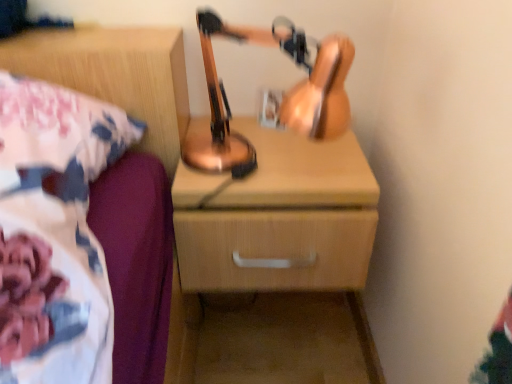
Question: Should I look upward or downward to see copper metallic table lamp at center?

Choices:
 (A) down
 (B) up

Answer: (B)

Question: Can you confirm if wooden chest of drawers at center is taller than copper metallic table lamp at center?

Choices:
 (A) yes
 (B) no

Answer: (B)

Question: From a real-world perspective, is wooden chest of drawers at center physically above copper metallic table lamp at center?

Choices:
 (A) no
 (B) yes

Answer: (A)

Question: Is the position of wooden chest of drawers at center more distant than that of copper metallic table lamp at center?

Choices:
 (A) no
 (B) yes

Answer: (B)

Question: Is wooden chest of drawers at center smaller than copper metallic table lamp at center?

Choices:
 (A) no
 (B) yes

Answer: (A)

Question: From a real-world perspective, is wooden chest of drawers at center beneath copper metallic table lamp at center?

Choices:
 (A) no
 (B) yes

Answer: (B)

Question: Does wooden chest of drawers at center have a lesser height compared to copper metallic table lamp at center?

Choices:
 (A) yes
 (B) no

Answer: (A)

Question: Is wooden nightstand at upper right at the left side of wooden chest of drawers at center?

Choices:
 (A) yes
 (B) no

Answer: (A)

Question: Does wooden nightstand at upper right lie in front of wooden chest of drawers at center?

Choices:
 (A) no
 (B) yes

Answer: (B)

Question: Is wooden nightstand at upper right far from wooden chest of drawers at center?

Choices:
 (A) yes
 (B) no

Answer: (B)

Question: Is wooden nightstand at upper right turned away from wooden chest of drawers at center?

Choices:
 (A) yes
 (B) no

Answer: (B)

Question: Is wooden nightstand at upper right at the right side of wooden chest of drawers at center?

Choices:
 (A) no
 (B) yes

Answer: (A)

Question: Does wooden nightstand at upper right touch wooden chest of drawers at center?

Choices:
 (A) yes
 (B) no

Answer: (B)

Question: Can we say wooden nightstand at upper right lies outside copper metallic table lamp at center?

Choices:
 (A) yes
 (B) no

Answer: (A)